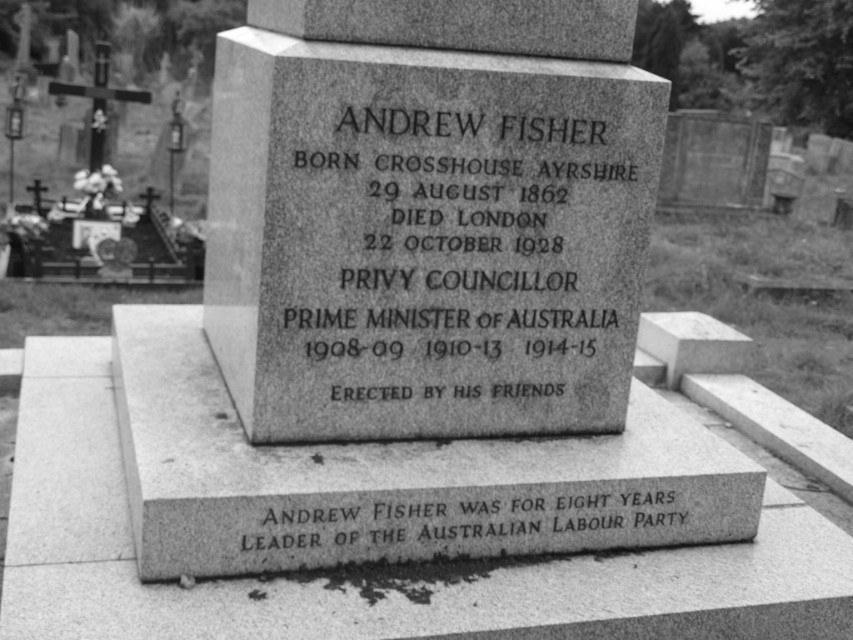
Consider the image. Who is positioned more to the left, granite plaque at center or black granite text at lower center?

granite plaque at center

What do you see at coordinates (456, 252) in the screenshot? I see `granite plaque at center` at bounding box center [456, 252].

Locate an element on the screen. Image resolution: width=853 pixels, height=640 pixels. granite plaque at center is located at coordinates (456, 252).